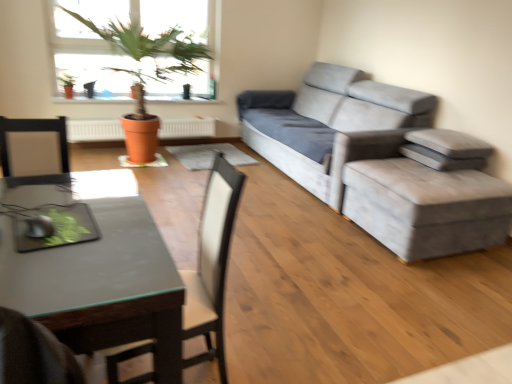
Question: Can you confirm if terracotta clay pot at upper left is shorter than gray fabric pillow at right, marked as the 1th pillow in a bottom-to-top arrangement?

Choices:
 (A) yes
 (B) no

Answer: (B)

Question: Does terracotta clay pot at upper left have a greater width compared to gray fabric pillow at right, marked as the 1th pillow in a bottom-to-top arrangement?

Choices:
 (A) no
 (B) yes

Answer: (A)

Question: Is terracotta clay pot at upper left in front of gray fabric pillow at right, marked as the 1th pillow in a bottom-to-top arrangement?

Choices:
 (A) yes
 (B) no

Answer: (B)

Question: Can you confirm if terracotta clay pot at upper left is positioned to the right of gray fabric pillow at right, placed as the 2th pillow when sorted from top to bottom?

Choices:
 (A) no
 (B) yes

Answer: (A)

Question: Does terracotta clay pot at upper left have a lesser width compared to gray fabric pillow at right, placed as the 2th pillow when sorted from top to bottom?

Choices:
 (A) yes
 (B) no

Answer: (A)

Question: Could you tell me if terracotta clay pot at upper left is facing gray fabric pillow at right, marked as the 1th pillow in a bottom-to-top arrangement?

Choices:
 (A) yes
 (B) no

Answer: (B)

Question: Considering the relative positions of gray fabric pillow at right, which ranks as the 2th pillow in bottom-to-top order, and terracotta clay pot at upper left in the image provided, is gray fabric pillow at right, which ranks as the 2th pillow in bottom-to-top order, behind terracotta clay pot at upper left?

Choices:
 (A) no
 (B) yes

Answer: (A)

Question: Can you confirm if gray fabric pillow at right, which ranks as the 2th pillow in bottom-to-top order, is taller than terracotta clay pot at upper left?

Choices:
 (A) yes
 (B) no

Answer: (B)

Question: From a real-world perspective, is gray fabric pillow at right, which ranks as the 2th pillow in bottom-to-top order, under terracotta clay pot at upper left?

Choices:
 (A) yes
 (B) no

Answer: (B)

Question: Is gray fabric pillow at right, which ranks as the 1th pillow in top-to-bottom order, positioned before terracotta clay pot at upper left?

Choices:
 (A) yes
 (B) no

Answer: (A)

Question: Does gray fabric pillow at right, which ranks as the 2th pillow in bottom-to-top order, have a lesser height compared to terracotta clay pot at upper left?

Choices:
 (A) no
 (B) yes

Answer: (B)

Question: Is gray fabric pillow at right, which ranks as the 2th pillow in bottom-to-top order, thinner than terracotta clay pot at upper left?

Choices:
 (A) yes
 (B) no

Answer: (B)

Question: From a real-world perspective, is black glass desk at lower left located beneath velvet grey stool at right?

Choices:
 (A) yes
 (B) no

Answer: (B)